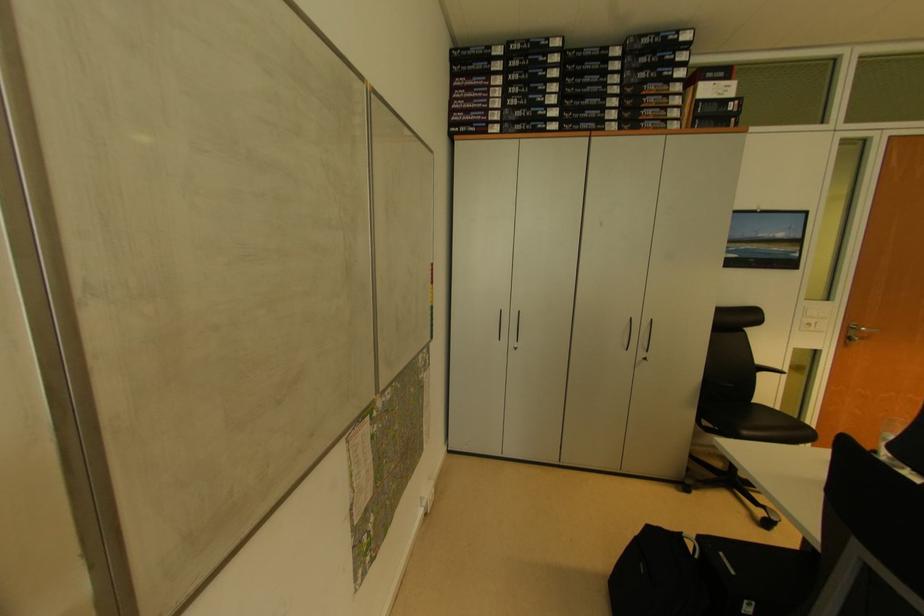
At what (x,y) coordinates should I click in order to perform the action: click on chair sitting surface. Please return your answer as a coordinate pair (x, y). Looking at the image, I should click on (772, 421).